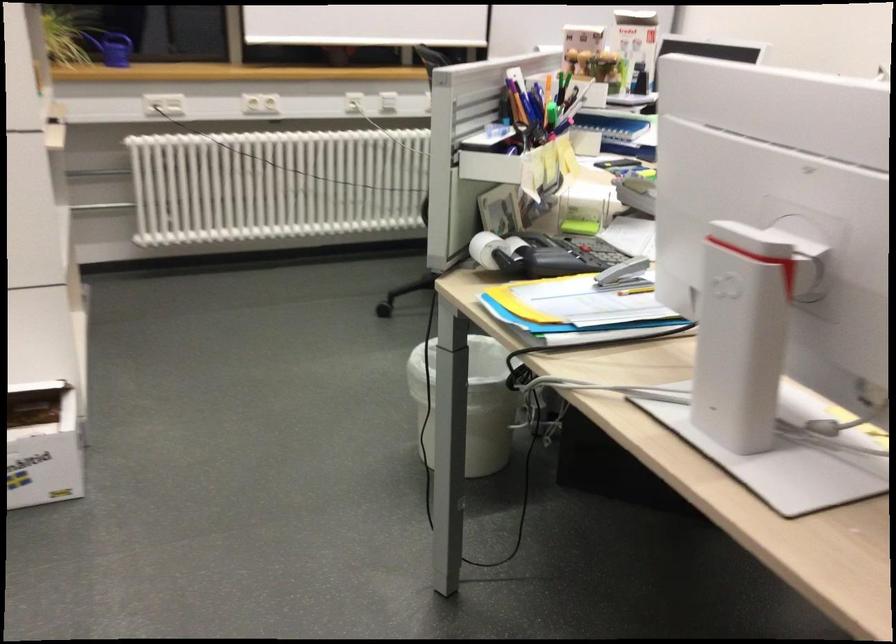
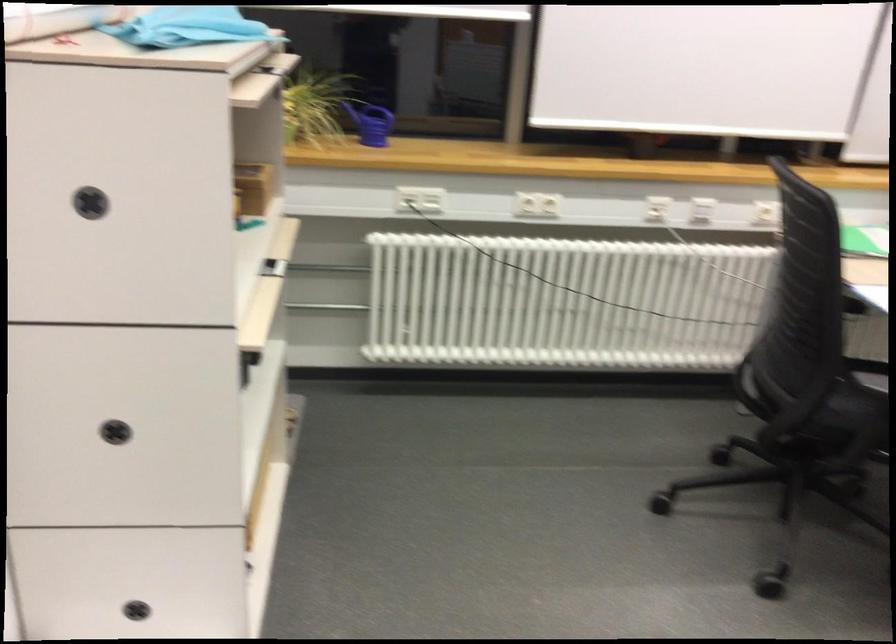
In the second image, find the point that corresponds to (257,100) in the first image.

(537, 205)